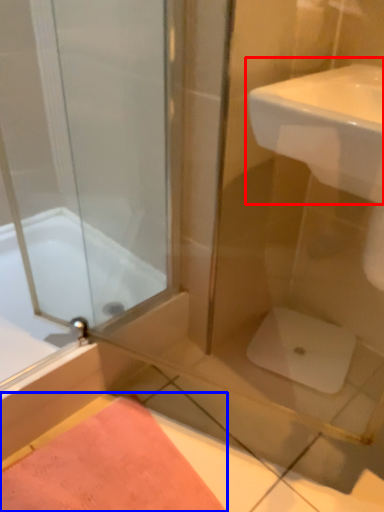
Question: Which point is further to the camera, sink (highlighted by a red box) or bath mat (highlighted by a blue box)?

Choices:
 (A) sink
 (B) bath mat

Answer: (B)